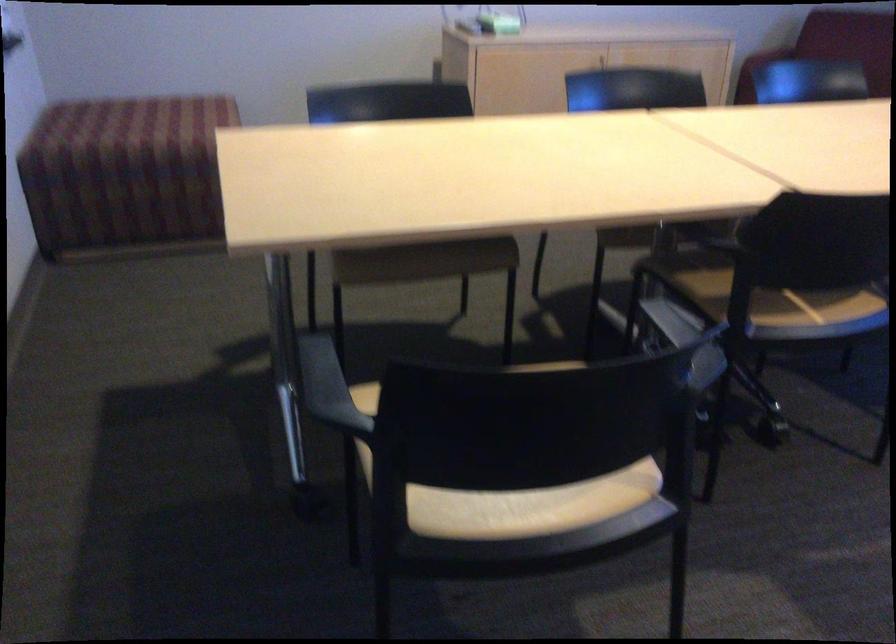
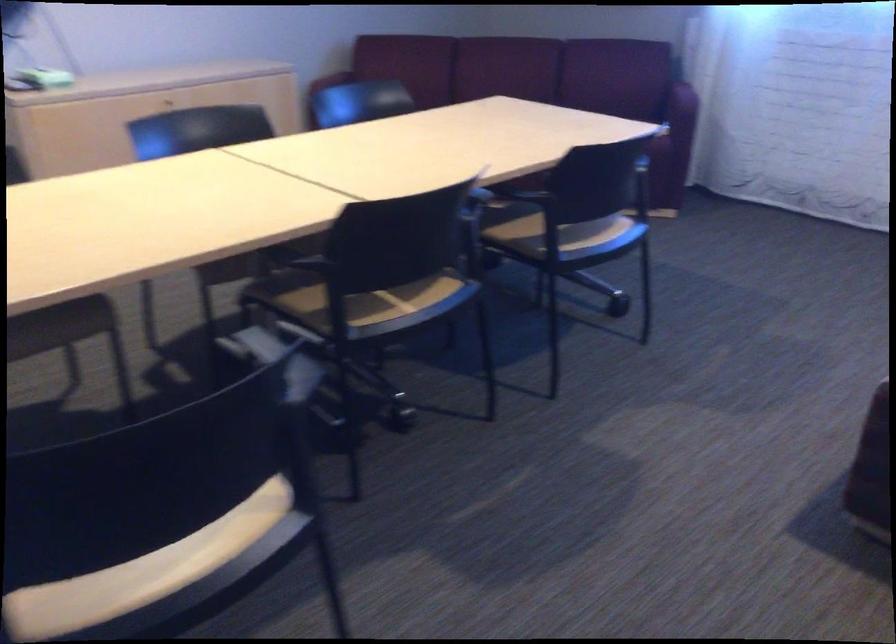
Question: The camera is either moving clockwise (left) or counter-clockwise (right) around the object. The first image is from the beginning of the video and the second image is from the end. Is the camera moving left or right when shooting the video?

Choices:
 (A) Left
 (B) Right

Answer: (A)